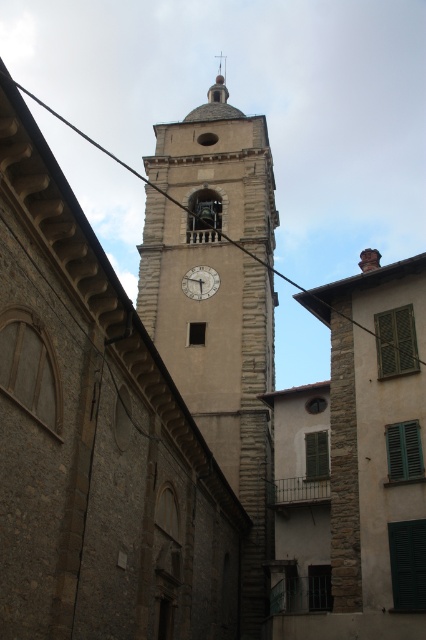
Consider the image. Is beige stone clock tower at center to the left of white matte clock at center from the viewer's perspective?

No, beige stone clock tower at center is not to the left of white matte clock at center.

Is beige stone clock tower at center further to the viewer compared to white matte clock at center?

That is False.

Who is more forward, [212,358] or [198,282]?

Point [212,358] is in front.

The image size is (426, 640). Find the location of `beige stone clock tower at center`. beige stone clock tower at center is located at coordinates (219, 282).

Is beige stone clock tower at center below black wire at upper center?

Yes.

Who is positioned more to the right, beige stone clock tower at center or black wire at upper center?

beige stone clock tower at center is more to the right.

Who is more forward, (239,253) or (45,106)?

Positioned in front is point (239,253).

Image resolution: width=426 pixels, height=640 pixels. I want to click on beige stone clock tower at center, so click(219, 282).

Does black wire at upper center have a greater height compared to white matte clock at center?

Yes.

Who is shorter, black wire at upper center or white matte clock at center?

white matte clock at center

Where is `black wire at upper center`? black wire at upper center is located at coordinates (88, 138).